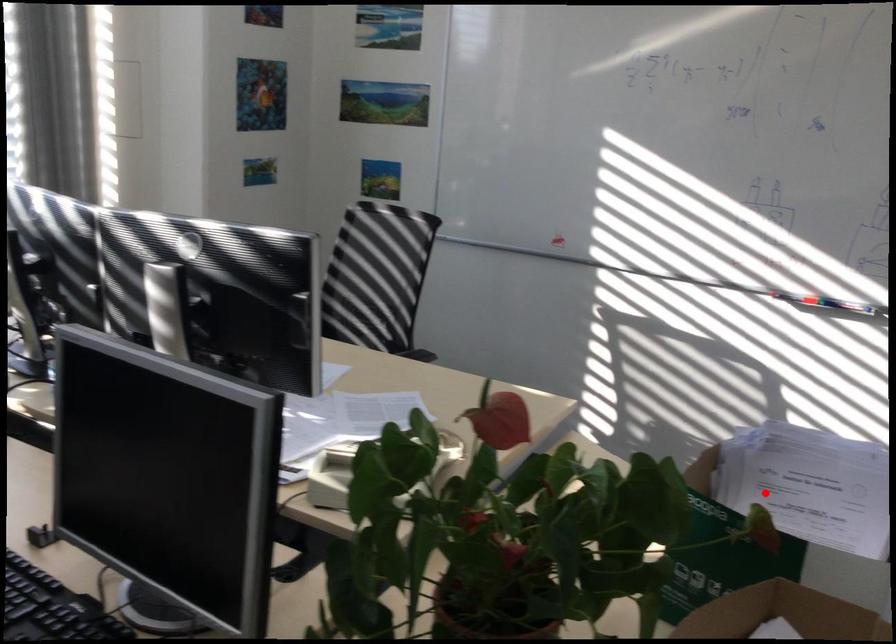
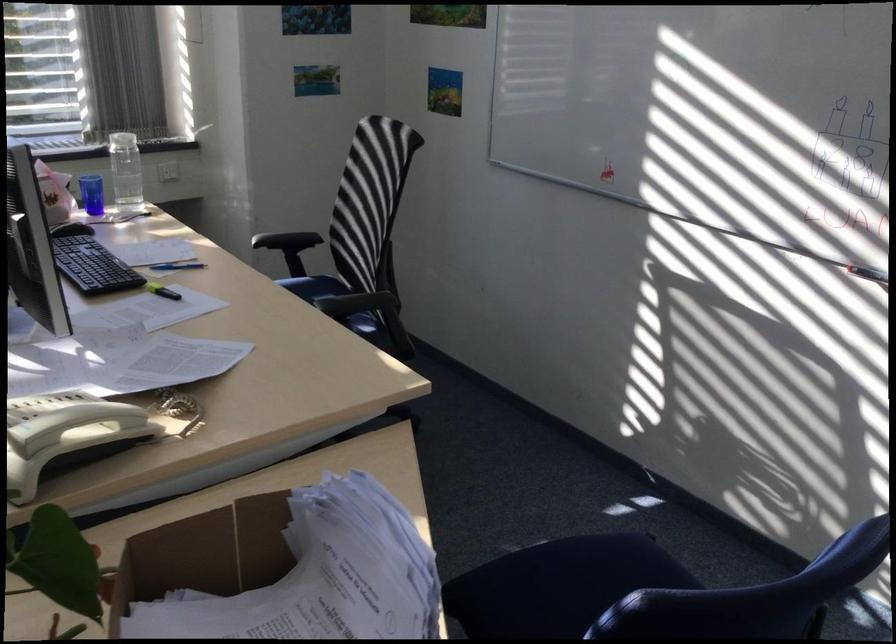
Question: I am providing you with two images of the same scene from different viewpoints. Image1 has a red point marked. In image2, the corresponding 3D location appears at what relative position? Reply with the corresponding letter.

Choices:
 (A) Closer
 (B) Farther

Answer: (A)